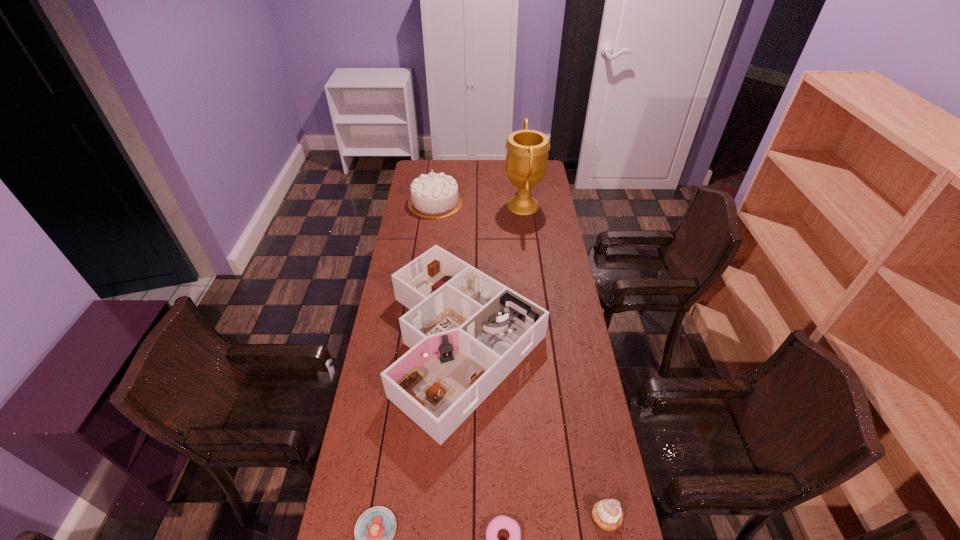
At what (x,y) coordinates should I click in order to perform the action: click on the tallest object. Please return your answer as a coordinate pair (x, y). Looking at the image, I should click on (526, 161).

Locate an element on the screen. This screenshot has height=540, width=960. birthday cake is located at coordinates tap(433, 195).

This screenshot has height=540, width=960. I want to click on dollhouse, so pyautogui.click(x=467, y=332).

The image size is (960, 540). What are the coordinates of `the fourth shortest object` in the screenshot? It's located at (467, 332).

Identify the location of the rightmost pastry. Image resolution: width=960 pixels, height=540 pixels. (607, 514).

Where is `the tallest pastry`? The width and height of the screenshot is (960, 540). the tallest pastry is located at coordinates (607, 514).

Where is `blank area located 0.210m on the engravings side of the tallest object`? This screenshot has height=540, width=960. blank area located 0.210m on the engravings side of the tallest object is located at coordinates (463, 205).

Image resolution: width=960 pixels, height=540 pixels. Find the location of `vacant position located on the engravings side of the tallest object`. vacant position located on the engravings side of the tallest object is located at coordinates (488, 205).

Find the location of a particular element. This screenshot has width=960, height=540. vacant space situated 0.130m on the engravings side of the tallest object is located at coordinates (478, 205).

Locate an element on the screen. free spot located on the back of the birthday cake is located at coordinates (438, 180).